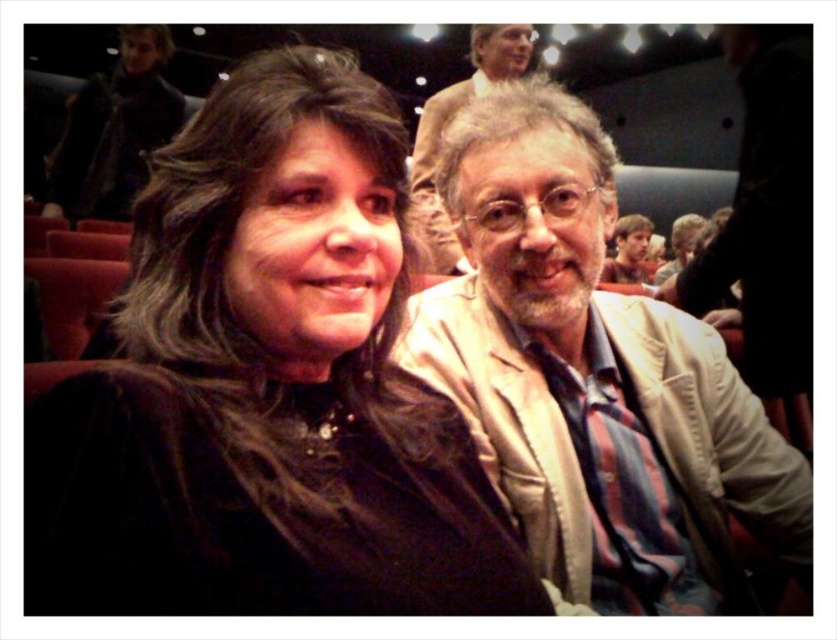
Which is more to the left, light beige jacket at center or matte black jacket at center?

matte black jacket at center

Describe the element at coordinates (593, 378) in the screenshot. I see `light beige jacket at center` at that location.

I want to click on light beige jacket at center, so click(x=593, y=378).

Is black velvet jacket at center behind smooth brown hair at upper right?

No, it is in front of smooth brown hair at upper right.

Is point (319, 378) farther from camera compared to point (639, 216)?

No, (319, 378) is closer to viewer.

Measure the distance between point (x=101, y=390) and camera.

They are 17.36 inches apart.

Locate an element on the screen. The width and height of the screenshot is (837, 640). black velvet jacket at center is located at coordinates (266, 388).

In the scene shown: Is light beige jacket at center shorter than smooth brown hair at upper right?

No, light beige jacket at center is not shorter than smooth brown hair at upper right.

Who is higher up, light beige jacket at center or smooth brown hair at upper right?

smooth brown hair at upper right is above.

Identify the location of light beige jacket at center. (x=593, y=378).